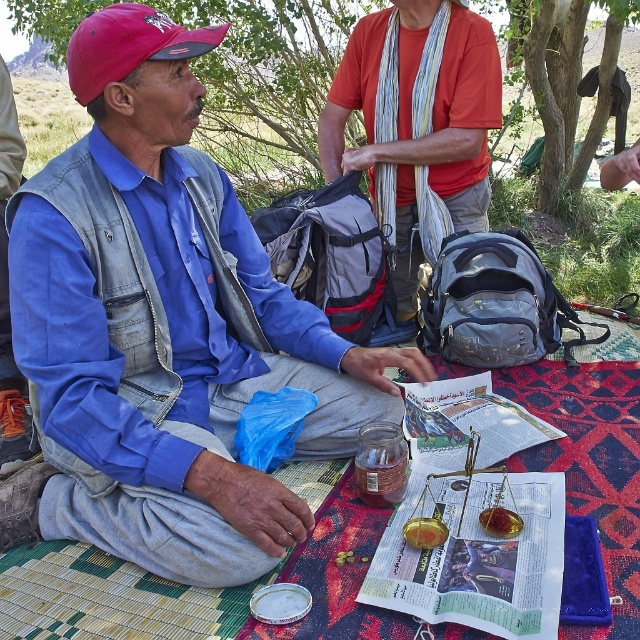
Is point (100, 440) closer to viewer compared to point (481, 17)?

Yes, point (100, 440) is closer to viewer.

Does denim vest at left appear on the left side of orange cotton shirt at center?

Indeed, denim vest at left is positioned on the left side of orange cotton shirt at center.

Is point (340, 364) farther from camera compared to point (440, 163)?

That is False.

You are a GUI agent. You are given a task and a screenshot of the screen. Output one action in this format:
    pyautogui.click(x=<x>, y=<y>)
    Task: Click on the denim vest at left
    
    Given the screenshot: What is the action you would take?
    pyautogui.click(x=161, y=332)

Is point (124, 432) positioned before point (531, 33)?

Yes.

From the picture: Is denim vest at left to the right of green leafy tree at center from the viewer's perspective?

Incorrect, denim vest at left is not on the right side of green leafy tree at center.

Identify the location of denim vest at left. This screenshot has width=640, height=640. (161, 332).

Does orange cotton shirt at center come behind green leafy tree at center?

That is False.

Can you confirm if orange cotton shirt at center is positioned to the right of green leafy tree at center?

Incorrect, orange cotton shirt at center is not on the right side of green leafy tree at center.

Between point (380, 42) and point (579, 97), which one is positioned in front?

Point (380, 42) is more forward.

Locate an element on the screen. The image size is (640, 640). orange cotton shirt at center is located at coordinates (410, 112).